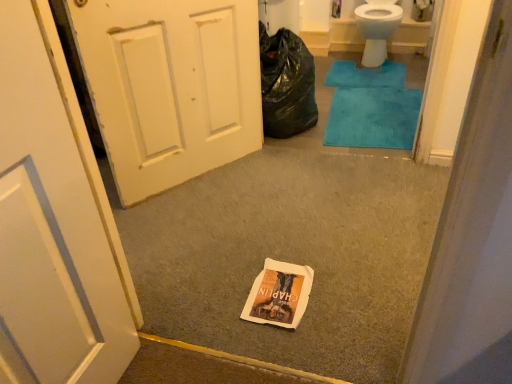
Identify the location of free location to the right of white paper bag at center. (341, 290).